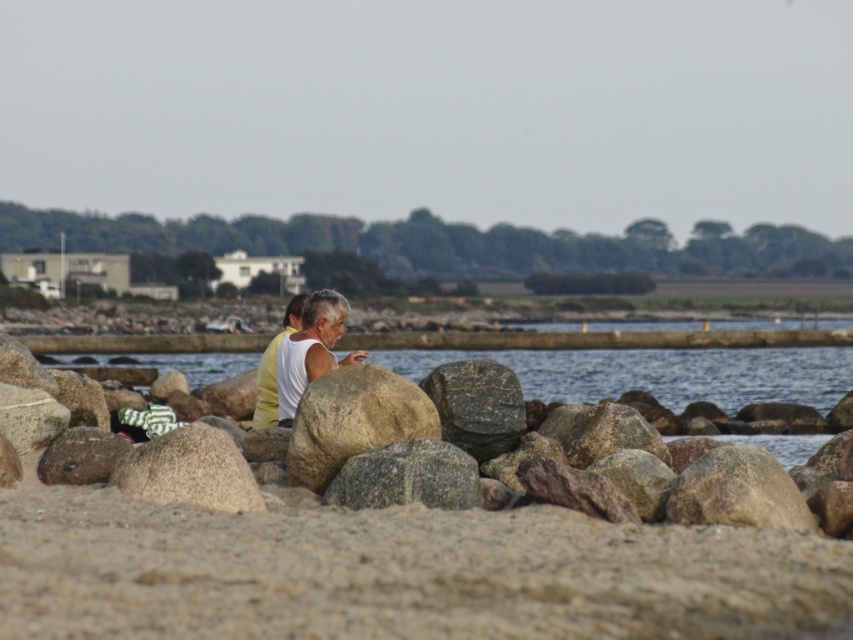
Which is more to the left, smooth beige sand at lower center or clear water at center?

Positioned to the left is smooth beige sand at lower center.

Who is more distant from viewer, (422, 522) or (761, 369)?

The point (761, 369) is behind.

Find the location of a particular element. Image resolution: width=853 pixels, height=640 pixels. smooth beige sand at lower center is located at coordinates (399, 573).

Based on the photo, does granite boulder at center lie in front of yellow fabric shirt at center?

Yes, it is in front of yellow fabric shirt at center.

You are a GUI agent. You are given a task and a screenshot of the screen. Output one action in this format:
    pyautogui.click(x=<x>, y=<y>)
    Task: Click on the granite boulder at center
    Image resolution: width=853 pixels, height=640 pixels.
    Given the screenshot: What is the action you would take?
    pyautogui.click(x=352, y=420)

Identify the location of clear water at center. coord(660,372).

Does point (712, 374) come farther from viewer compared to point (402, 440)?

Yes, point (712, 374) is farther from viewer.

Which is behind, point (718, 394) or point (314, 484)?

The point (718, 394) is more distant.

Find the location of a particular element. The height and width of the screenshot is (640, 853). clear water at center is located at coordinates (660, 372).